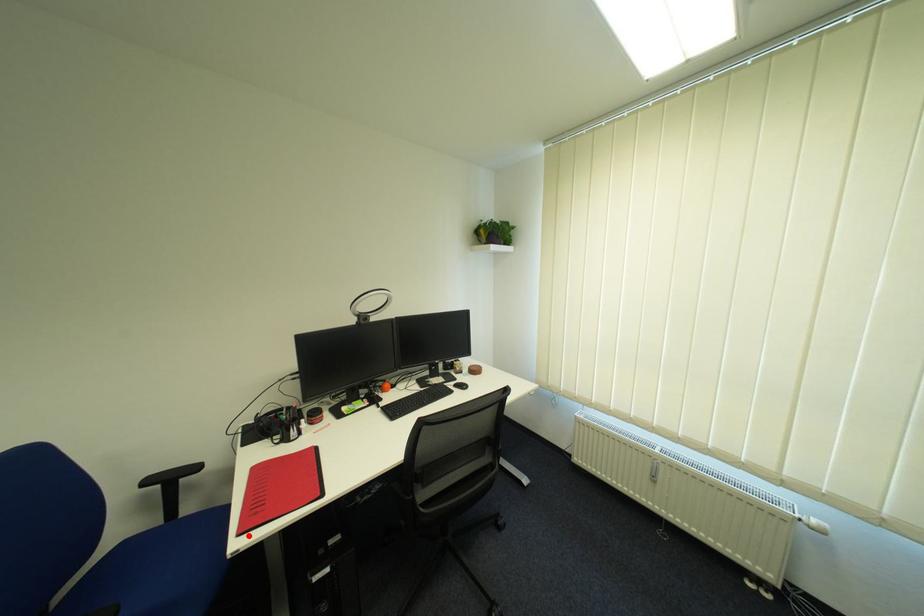
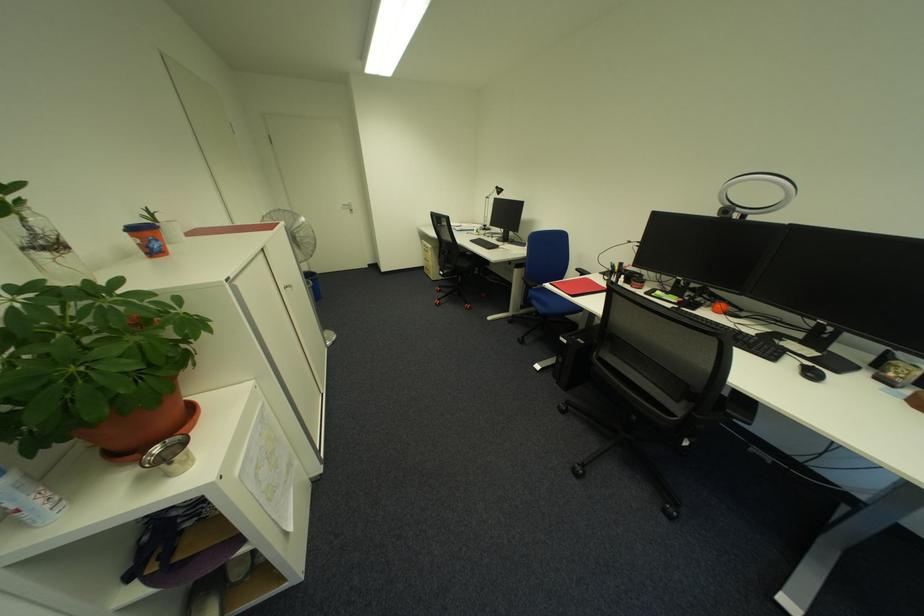
Find the pixel in the second image that matches the highlighted location in the first image.

(560, 285)